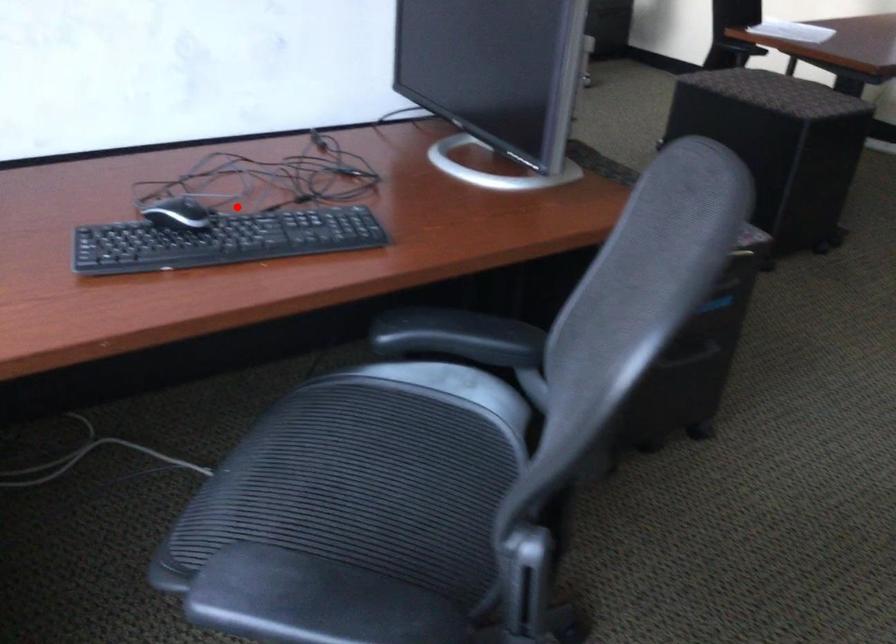
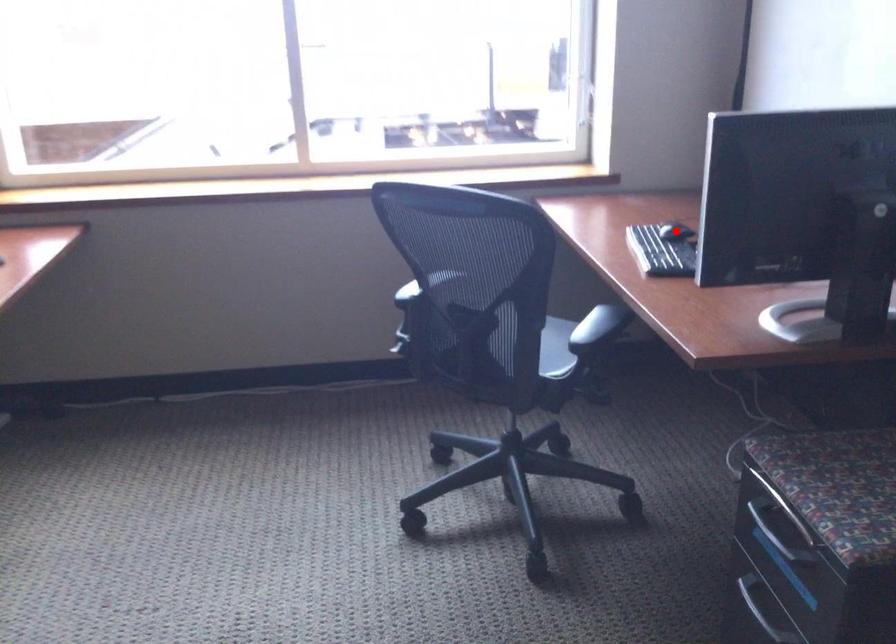
I am providing you with two images of the same scene from different viewpoints. A red point is marked on the first image and another point is marked on the second image. Is the red point in image1 aligned with the point shown in image2?

Yes